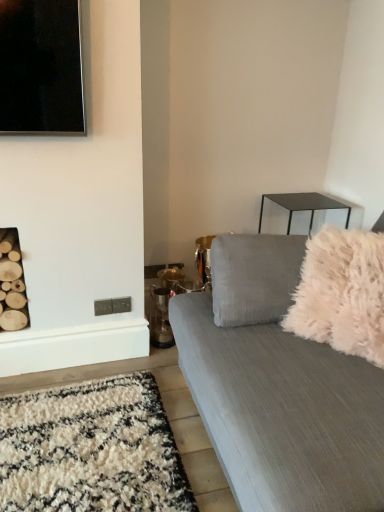
Question: From their relative heights in the image, would you say textured gray couch at right is taller or shorter than white fluffy throw pillow at right?

Choices:
 (A) short
 (B) tall

Answer: (B)

Question: Is textured gray couch at right bigger or smaller than white fluffy throw pillow at right?

Choices:
 (A) small
 (B) big

Answer: (B)

Question: In terms of width, does textured gray couch at right look wider or thinner when compared to white fluffy throw pillow at right?

Choices:
 (A) wide
 (B) thin

Answer: (A)

Question: Looking at the image, does white fluffy throw pillow at right seem bigger or smaller compared to textured gray couch at right?

Choices:
 (A) big
 (B) small

Answer: (B)

Question: Is white fluffy throw pillow at right wider or thinner than textured gray couch at right?

Choices:
 (A) wide
 (B) thin

Answer: (B)

Question: Considering the positions of point (314, 327) and point (203, 393), is point (314, 327) closer or farther from the camera than point (203, 393)?

Choices:
 (A) closer
 (B) farther

Answer: (B)

Question: Is white fluffy throw pillow at right in front of or behind textured gray couch at right in the image?

Choices:
 (A) front
 (B) behind

Answer: (B)